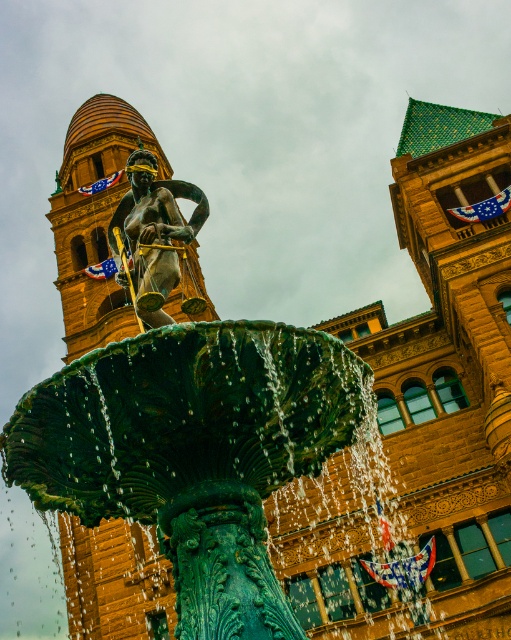
Is golden stone bell tower at upper left smaller than bronze statue at center?

Incorrect, golden stone bell tower at upper left is not smaller in size than bronze statue at center.

Describe the element at coordinates (95, 220) in the screenshot. The height and width of the screenshot is (640, 511). I see `golden stone bell tower at upper left` at that location.

Which is behind, point (74, 532) or point (117, 264)?

The point (74, 532) is more distant.

Image resolution: width=511 pixels, height=640 pixels. I want to click on golden stone bell tower at upper left, so coord(95,220).